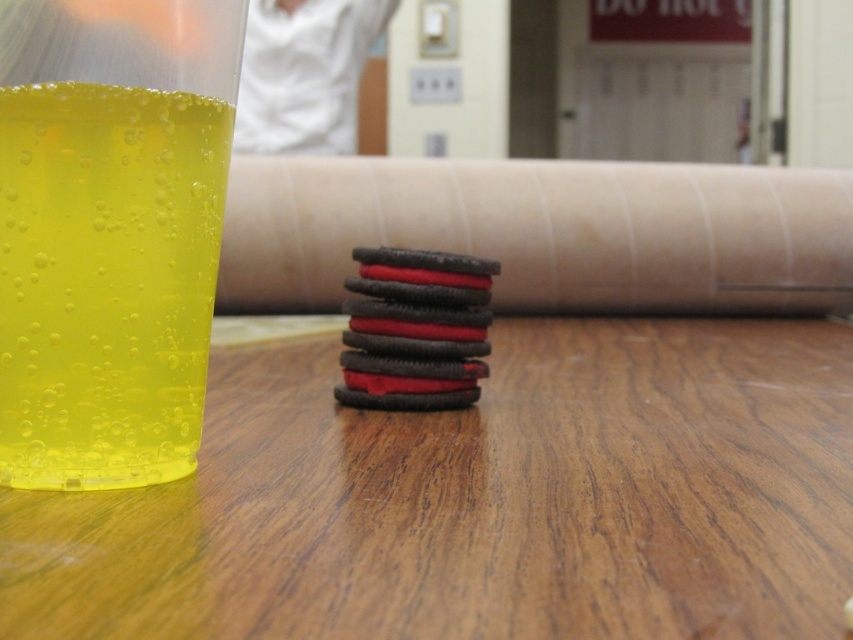
Which is behind, point (328, 609) or point (202, 228)?

The point (202, 228) is behind.

Does wooden table at center have a lesser height compared to translucent yellow liquid at left?

Yes.

Consider the image. Who is more forward, (816,385) or (123,301)?

Positioned in front is point (123,301).

You are a GUI agent. You are given a task and a screenshot of the screen. Output one action in this format:
    pyautogui.click(x=<x>, y=<y>)
    Task: Click on the wooden table at center
    The image size is (853, 640).
    Given the screenshot: What is the action you would take?
    pyautogui.click(x=479, y=499)